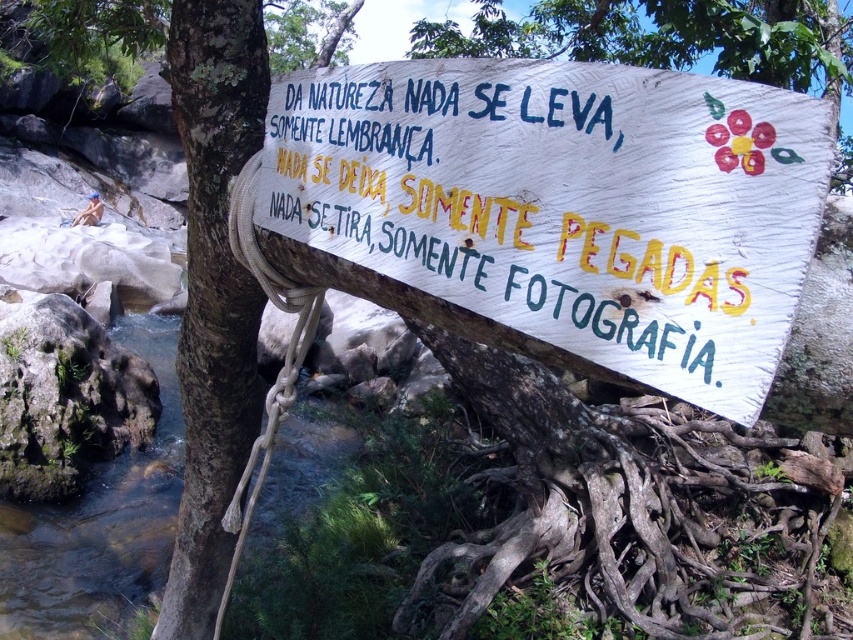
Question: Is white wooden sign at center thinner than clear water at creek right?

Choices:
 (A) no
 (B) yes

Answer: (A)

Question: Which of the following is the closest to the observer?

Choices:
 (A) (473, 189)
 (B) (114, 624)

Answer: (A)

Question: Which point is closer to the camera?

Choices:
 (A) (469, 211)
 (B) (155, 365)

Answer: (A)

Question: Does white wooden sign at center lie behind clear water at creek right?

Choices:
 (A) no
 (B) yes

Answer: (A)

Question: From the image, what is the correct spatial relationship of white wooden sign at center in relation to clear water at creek right?

Choices:
 (A) right
 (B) left

Answer: (A)